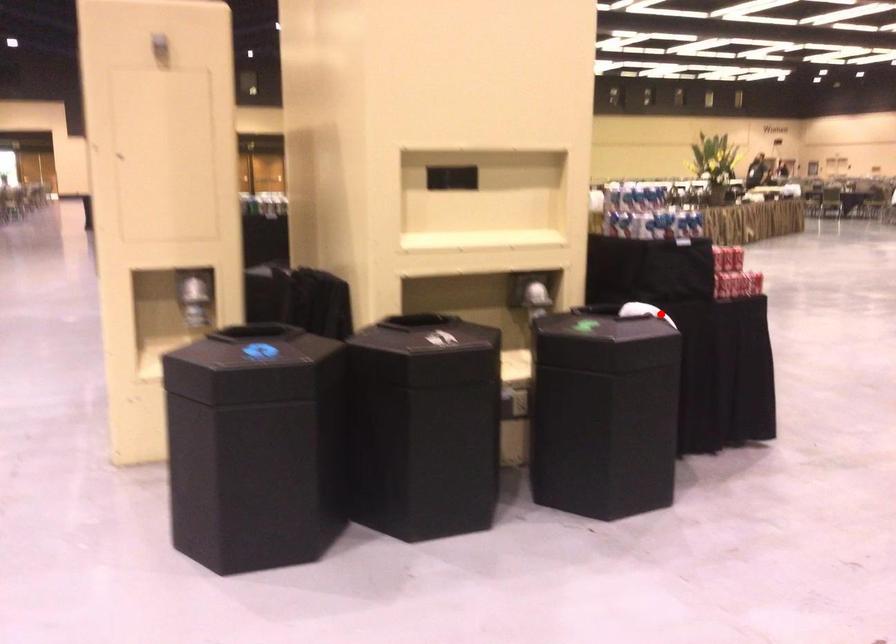
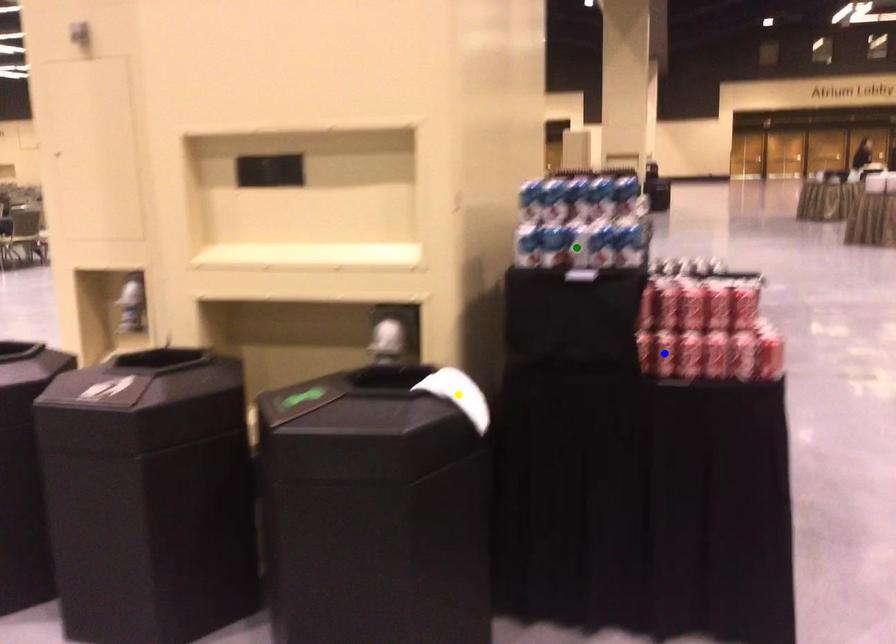
Question: I am providing you with two images of the same scene from different viewpoints. A red point is marked on the first image. You are given multiple points on the second image. Which point in image 2 is actually the same real-world point as the red point in image 1?

Choices:
 (A) yellow point
 (B) green point
 (C) blue point

Answer: (A)